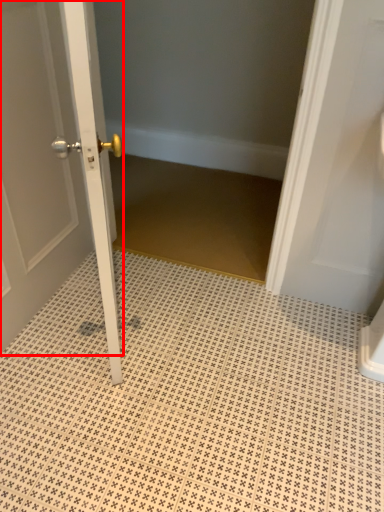
Question: From the image's perspective, where is door (annotated by the red box) located in relation to ceramic tile in the image?

Choices:
 (A) above
 (B) below

Answer: (A)